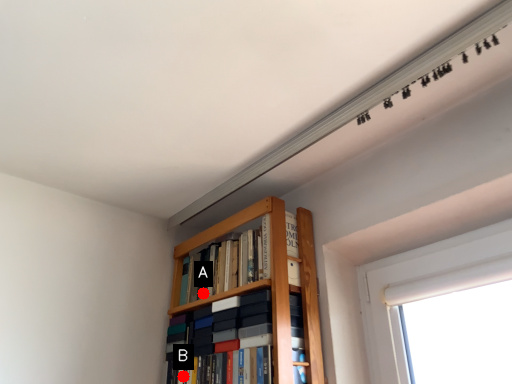
Question: Two points are circled on the image, labeled by A and B beside each circle. Which point is further to the camera?

Choices:
 (A) A is further
 (B) B is further

Answer: (A)